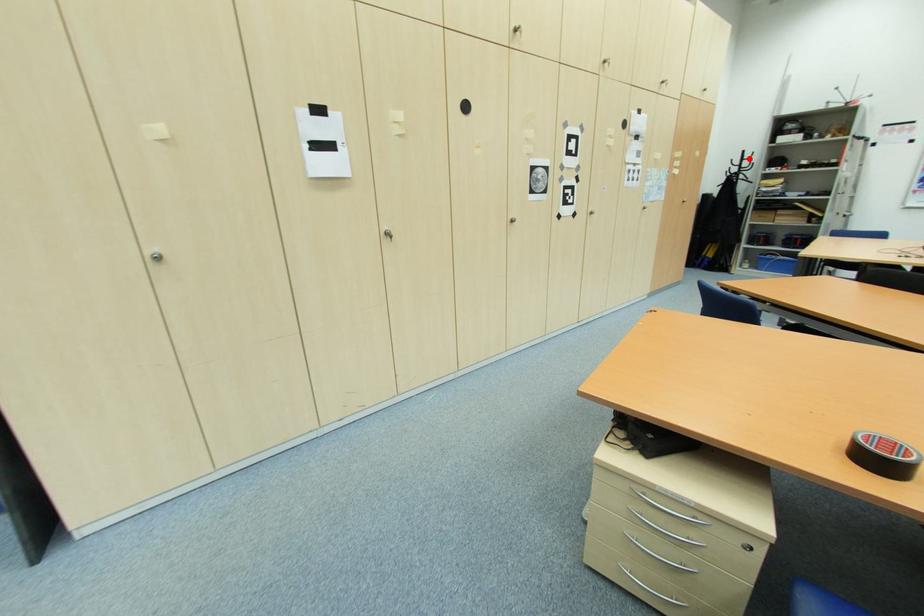
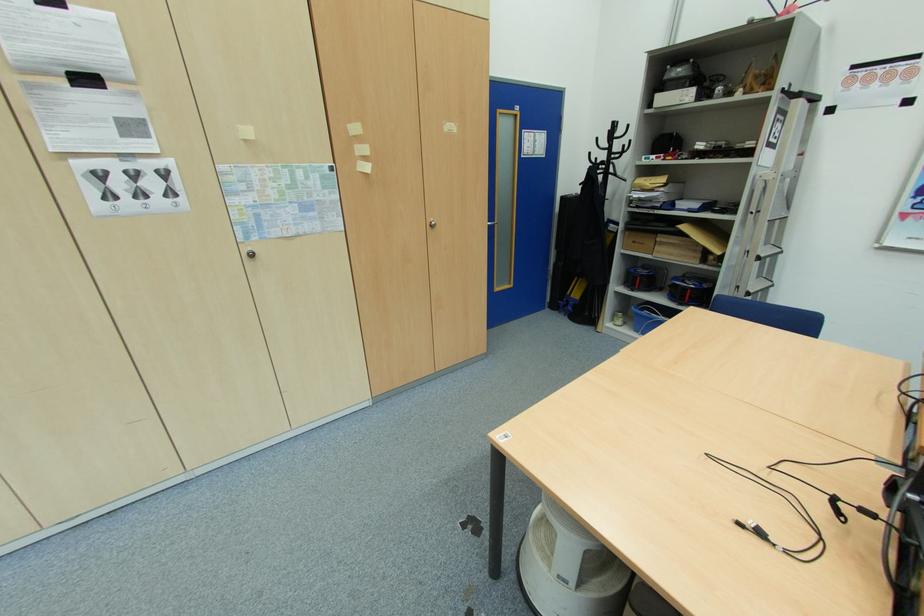
Locate, in the second image, the point that corresponds to the highlighted location in the first image.

(619, 136)